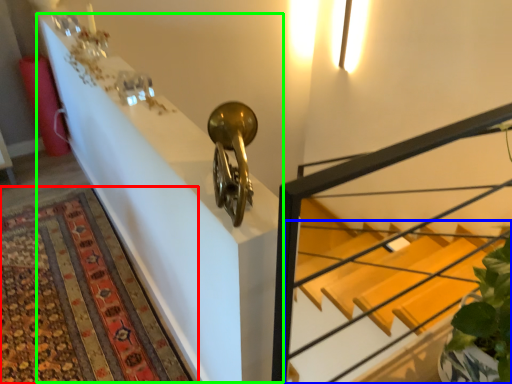
Question: Based on their relative distances, which object is nearer to mat (highlighted by a red box)? Choose from stairs (highlighted by a blue box) and table (highlighted by a green box).

Choices:
 (A) stairs
 (B) table

Answer: (B)